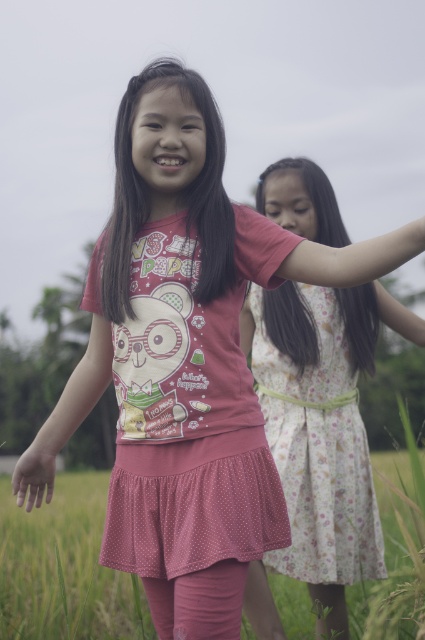
Question: Which of the following is the closest to the observer?

Choices:
 (A) (376, 500)
 (B) (47, 499)
 (C) (311, 253)
 (D) (31, 468)

Answer: (C)

Question: Which point is closer to the camera?

Choices:
 (A) floral cotton dress at center
 (B) matte pink hand at lower left
 (C) matte pink arm at center
 (D) pink polka dot skirt at center

Answer: (C)

Question: In this image, where is pink polka dot skirt at center located relative to pink fabric arm at center?

Choices:
 (A) right
 (B) left

Answer: (B)

Question: Is matte pink arm at center positioned before pink fabric arm at center?

Choices:
 (A) yes
 (B) no

Answer: (A)

Question: Which is farther from the pink polka dot dress at center?

Choices:
 (A) pink fabric arm at center
 (B) matte pink arm at center
 (C) floral cotton dress at center
 (D) pink polka dot skirt at center

Answer: (D)

Question: Is pink polka dot skirt at center positioned behind matte pink arm at center?

Choices:
 (A) yes
 (B) no

Answer: (A)